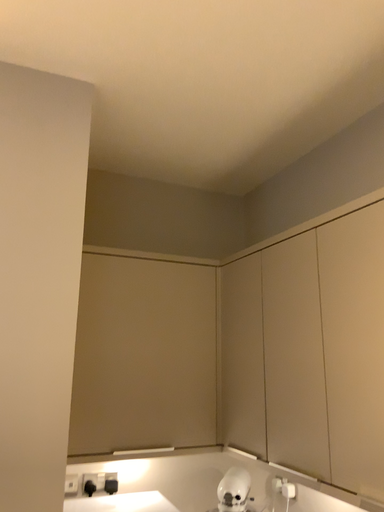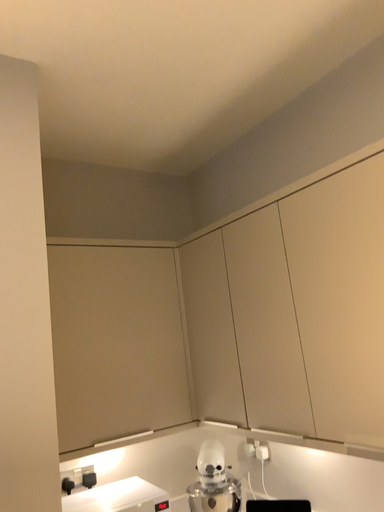
Question: How did the camera likely rotate when shooting the video?

Choices:
 (A) rotated left
 (B) rotated right

Answer: (B)